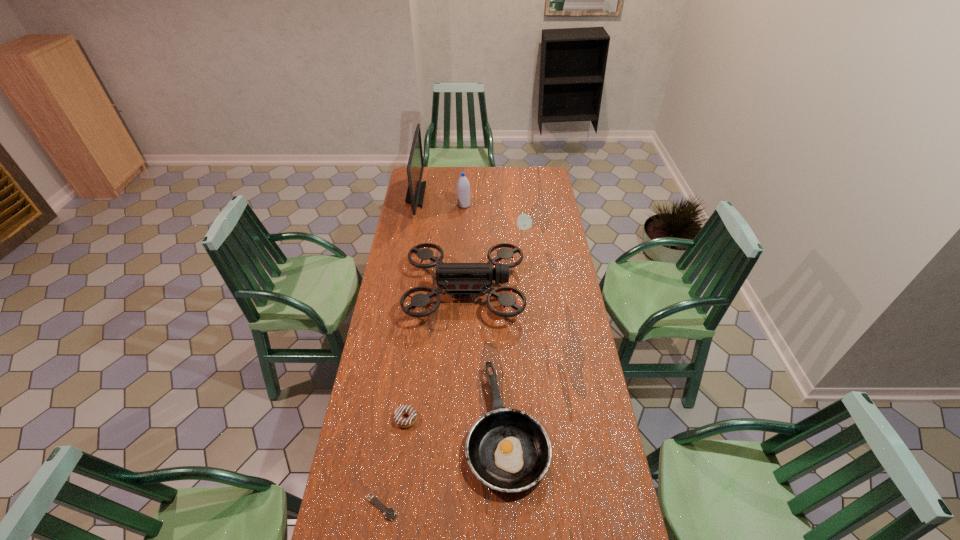
You are a GUI agent. You are given a task and a screenshot of the screen. Output one action in this format:
    pyautogui.click(x=<x>, y=<y>)
    Task: Click on the object that is the closest to the sixth shortest object
    The width and height of the screenshot is (960, 540).
    Given the screenshot: What is the action you would take?
    pyautogui.click(x=416, y=189)

Find the location of a particular element. The image size is (960, 540). free spot that satisfies the following two spatial constraints: 1. on the back side of the sixth shortest object; 2. on the right side of the sixth tallest object is located at coordinates (434, 205).

The width and height of the screenshot is (960, 540). I want to click on vacant region that satisfies the following two spatial constraints: 1. on the screen side of the monitor; 2. on the back side of the doughnut, so click(374, 418).

I want to click on free space that satisfies the following two spatial constraints: 1. on the front side of the sixth tallest object; 2. on the right side of the frying pan, so click(x=405, y=427).